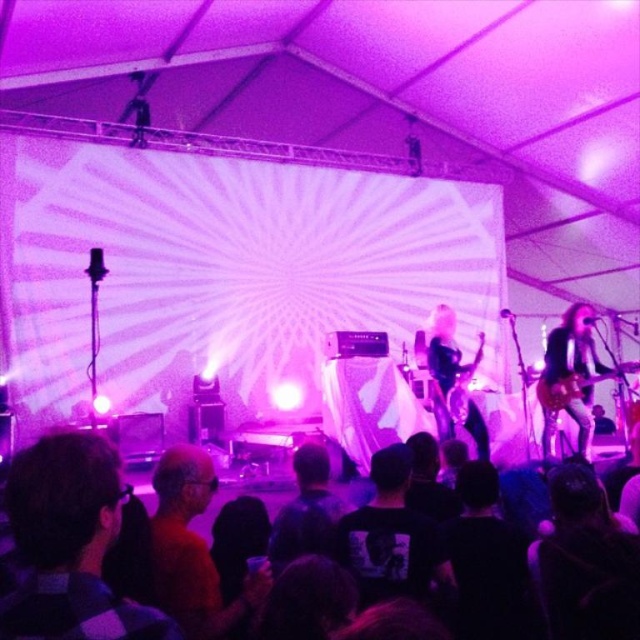
Which is behind, point (152, 612) or point (454, 374)?

Positioned behind is point (454, 374).

Is point (115, 604) positioned before point (435, 378)?

Yes, it is.

You are a GUI agent. You are given a task and a screenshot of the screen. Output one action in this format:
    pyautogui.click(x=<x>, y=<y>)
    Task: Click on the plaid shirt at lower left
    This screenshot has width=640, height=640.
    Given the screenshot: What is the action you would take?
    pyautogui.click(x=70, y=545)

Which is behind, point (460, 364) or point (564, 403)?

Point (460, 364)

Is point (442, 317) closer to camera compared to point (604, 376)?

That is False.

Which is in front, point (444, 320) or point (556, 380)?

Point (556, 380)

Image resolution: width=640 pixels, height=640 pixels. What are the coordinates of `shiny black guitar at center` in the screenshot? It's located at (445, 365).

Is dark blue shirt at center to the right of shiny black guitar at center from the viewer's perspective?

No, dark blue shirt at center is not to the right of shiny black guitar at center.

Can you confirm if dark blue shirt at center is positioned below shiny black guitar at center?

Yes, dark blue shirt at center is below shiny black guitar at center.

The image size is (640, 640). Identify the location of dark blue shirt at center. (307, 509).